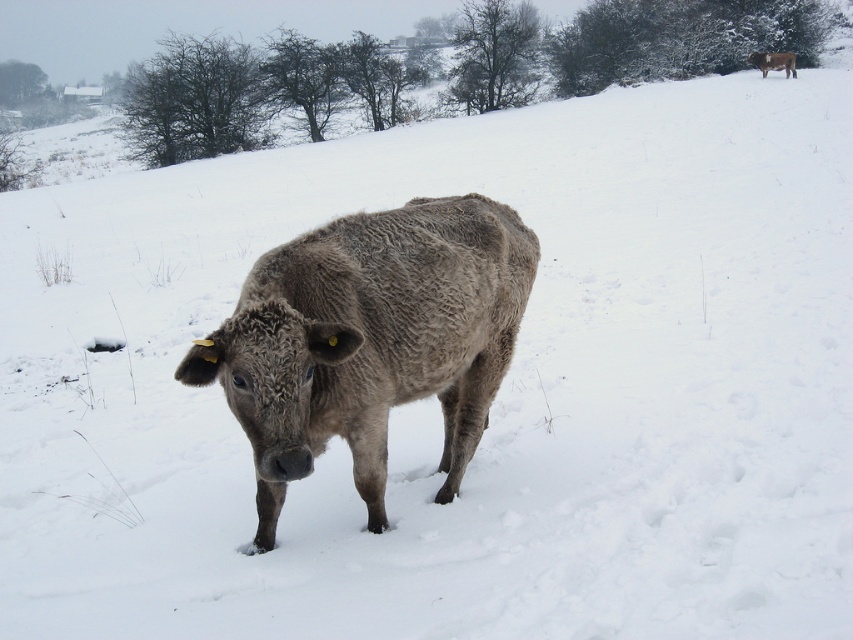
Does point (369, 358) come behind point (780, 67)?

That is False.

Between point (316, 266) and point (776, 67), which one is positioned behind?

The point (776, 67) is more distant.

The width and height of the screenshot is (853, 640). What do you see at coordinates (370, 340) in the screenshot?
I see `gray woolly bison at center` at bounding box center [370, 340].

This screenshot has height=640, width=853. I want to click on gray woolly bison at center, so click(370, 340).